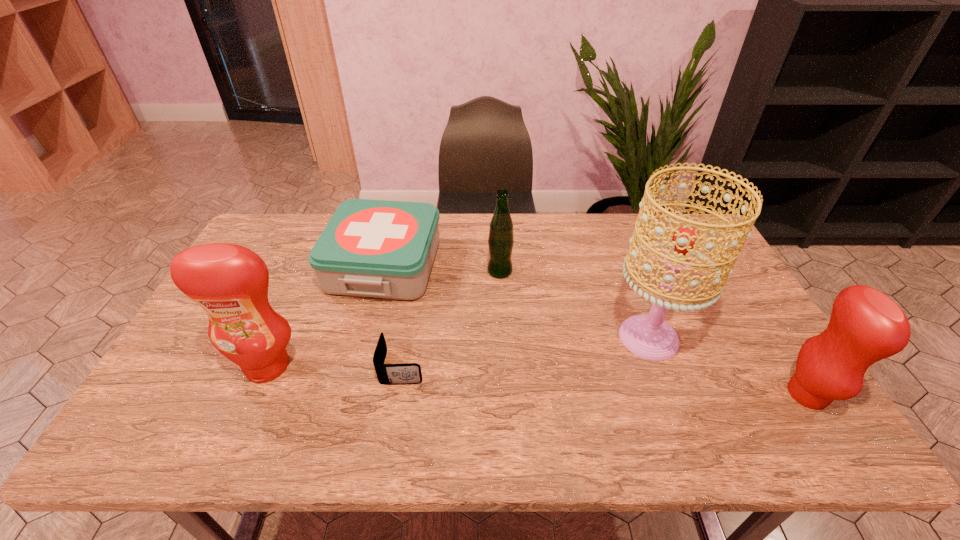
In order to click on vacant space at the near edge of the desktop in this screenshot , I will do `click(398, 385)`.

Find the location of a particular element. The image size is (960, 540). vacant area at the left edge is located at coordinates (285, 260).

The height and width of the screenshot is (540, 960). In order to click on vacant position at the right edge of the desktop in this screenshot , I will do `click(759, 343)`.

This screenshot has width=960, height=540. Find the location of `free space at the far left corner of the desktop`. free space at the far left corner of the desktop is located at coordinates (296, 236).

Where is `free space at the near left corner of the desktop`? free space at the near left corner of the desktop is located at coordinates (207, 408).

What are the coordinates of `free space between the wallet and the lampshade` in the screenshot? It's located at (525, 353).

At what (x,y) coordinates should I click in order to perform the action: click on free space between the shorter condiment and the wallet. Please return your answer as a coordinate pair (x, y). Image resolution: width=960 pixels, height=540 pixels. Looking at the image, I should click on (605, 381).

Where is `vacant area between the fifth tallest object and the wallet`? Image resolution: width=960 pixels, height=540 pixels. vacant area between the fifth tallest object and the wallet is located at coordinates (393, 316).

I want to click on vacant space that is in between the beer bottle and the fifth tallest object, so (x=442, y=268).

Locate an element on the screen. The height and width of the screenshot is (540, 960). vacant area between the shortest object and the taller condiment is located at coordinates (335, 367).